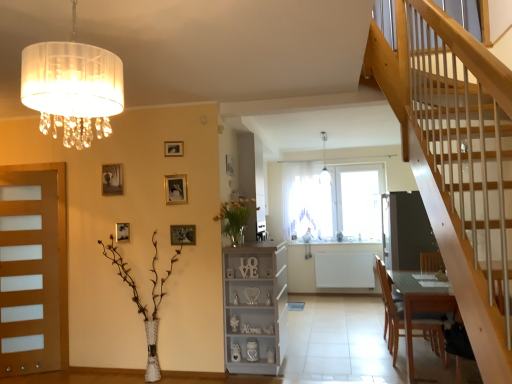
Question: Is translucent glass vase at left, the 1th floral arrangement in the left-to-right sequence, facing towards dark gray matte screen door at center?

Choices:
 (A) yes
 (B) no

Answer: (B)

Question: Is translucent glass vase at left, acting as the second floral arrangement starting from the right, closer to camera compared to dark gray matte screen door at center?

Choices:
 (A) no
 (B) yes

Answer: (B)

Question: Is translucent glass vase at left, arranged as the 1th floral arrangement when ordered from the bottom, outside of dark gray matte screen door at center?

Choices:
 (A) no
 (B) yes

Answer: (B)

Question: Can you confirm if translucent glass vase at left, acting as the second floral arrangement starting from the right, is bigger than dark gray matte screen door at center?

Choices:
 (A) yes
 (B) no

Answer: (B)

Question: Considering the relative sizes of translucent glass vase at left, arranged as the 1th floral arrangement when ordered from the bottom, and dark gray matte screen door at center in the image provided, is translucent glass vase at left, arranged as the 1th floral arrangement when ordered from the bottom, shorter than dark gray matte screen door at center?

Choices:
 (A) yes
 (B) no

Answer: (A)

Question: Considering the relative sizes of translucent glass vase at left, arranged as the 1th floral arrangement when ordered from the bottom, and dark gray matte screen door at center in the image provided, is translucent glass vase at left, arranged as the 1th floral arrangement when ordered from the bottom, taller than dark gray matte screen door at center?

Choices:
 (A) no
 (B) yes

Answer: (A)

Question: Is translucent fabric lampshade at upper left thinner than metallic gold picture frame at upper center, which appears as the sixth picture frame when viewed from the back?

Choices:
 (A) yes
 (B) no

Answer: (B)

Question: Can you confirm if translucent fabric lampshade at upper left is positioned to the left of metallic gold picture frame at upper center, the fifth picture frame positioned from the left?

Choices:
 (A) no
 (B) yes

Answer: (B)

Question: Is translucent fabric lampshade at upper left not inside metallic gold picture frame at upper center, the second picture frame from the right?

Choices:
 (A) yes
 (B) no

Answer: (A)

Question: Does translucent fabric lampshade at upper left come behind metallic gold picture frame at upper center, which appears as the sixth picture frame when viewed from the back?

Choices:
 (A) no
 (B) yes

Answer: (A)

Question: Could you tell me if translucent fabric lampshade at upper left is facing metallic gold picture frame at upper center, the fifth picture frame positioned from the left?

Choices:
 (A) no
 (B) yes

Answer: (A)

Question: Does translucent fabric lampshade at upper left have a lesser height compared to metallic gold picture frame at upper center, the second picture frame from the right?

Choices:
 (A) yes
 (B) no

Answer: (B)

Question: Does wooden picture frame at upper center, which is the 3th picture frame in left-to-right order, have a lesser height compared to matte gold picture frame at upper left, the first picture frame in the left-to-right sequence?

Choices:
 (A) yes
 (B) no

Answer: (A)